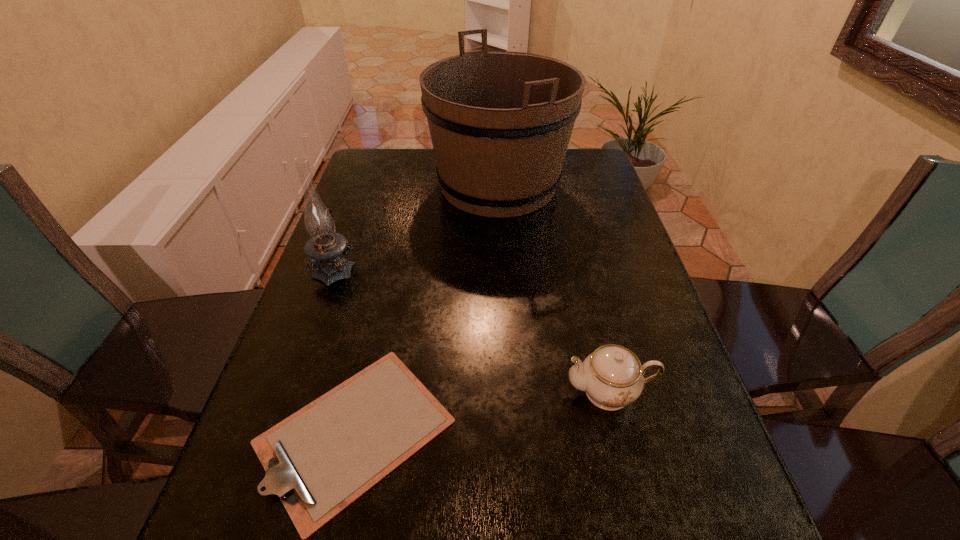
Identify the location of the farthest object. This screenshot has width=960, height=540. (500, 122).

I want to click on the tallest object, so click(500, 122).

Locate an element on the screen. The image size is (960, 540). the third shortest object is located at coordinates (324, 248).

This screenshot has height=540, width=960. Find the location of `the third nearest object`. the third nearest object is located at coordinates (324, 248).

Find the location of a particular element. Image resolution: width=960 pixels, height=540 pixels. the second shortest object is located at coordinates (612, 376).

You are a GUI agent. You are given a task and a screenshot of the screen. Output one action in this format:
    pyautogui.click(x=<x>, y=<y>)
    Task: Click on the vacant space situated on the front of the bucket
    The height and width of the screenshot is (540, 960).
    Given the screenshot: What is the action you would take?
    pyautogui.click(x=505, y=299)

This screenshot has width=960, height=540. Find the location of `free space located on the right of the oil lamp`. free space located on the right of the oil lamp is located at coordinates (499, 267).

The image size is (960, 540). Identify the location of vacant space located 0.300m at the spout of the chinaware. (410, 392).

Find the location of a particular element. vacant area situated at the spout of the chinaware is located at coordinates (390, 392).

This screenshot has width=960, height=540. Find the location of `free space located at the spout of the chinaware`. free space located at the spout of the chinaware is located at coordinates (492, 392).